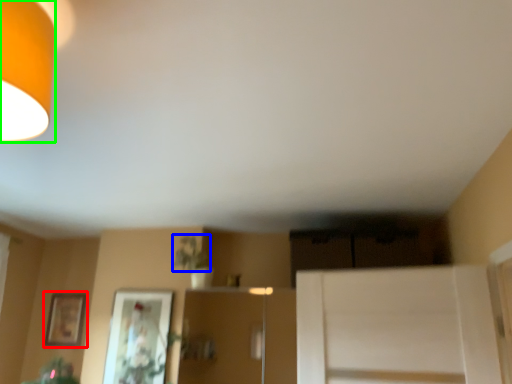
Question: Estimate the real-world distances between objects in this image. Which object is farther from picture frame (highlighted by a red box), plant (highlighted by a blue box) or lamp (highlighted by a green box)?

Choices:
 (A) plant
 (B) lamp

Answer: (B)